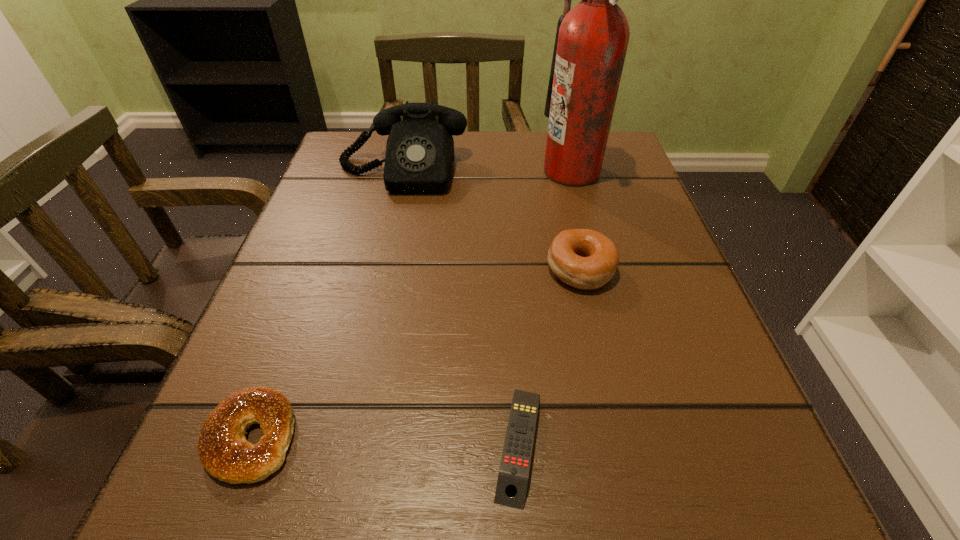
Where is `free space at the far left corner of the desktop`? free space at the far left corner of the desktop is located at coordinates (339, 153).

This screenshot has width=960, height=540. Find the location of `free space between the fourth tallest object and the second tallest object`. free space between the fourth tallest object and the second tallest object is located at coordinates (326, 305).

This screenshot has width=960, height=540. In order to click on free area in between the right bagel and the telephone in this screenshot , I will do `click(492, 221)`.

Image resolution: width=960 pixels, height=540 pixels. Find the location of `vacant point located between the tallest object and the third tallest object`. vacant point located between the tallest object and the third tallest object is located at coordinates (575, 220).

Locate an element on the screen. The image size is (960, 540). free space between the farther bagel and the remote control is located at coordinates (549, 357).

Find the location of `free point between the third farthest object and the telephone`. free point between the third farthest object and the telephone is located at coordinates (492, 221).

Where is `free space between the shorter bagel and the shortest object`? free space between the shorter bagel and the shortest object is located at coordinates (385, 441).

The height and width of the screenshot is (540, 960). I want to click on blank region between the fire extinguisher and the shortest object, so click(x=545, y=308).

Where is `empty location between the fourth shortest object and the fire extinguisher`? This screenshot has width=960, height=540. empty location between the fourth shortest object and the fire extinguisher is located at coordinates (487, 172).

Where is `empty space that is in between the shortest object and the second shortest object`? empty space that is in between the shortest object and the second shortest object is located at coordinates (385, 441).